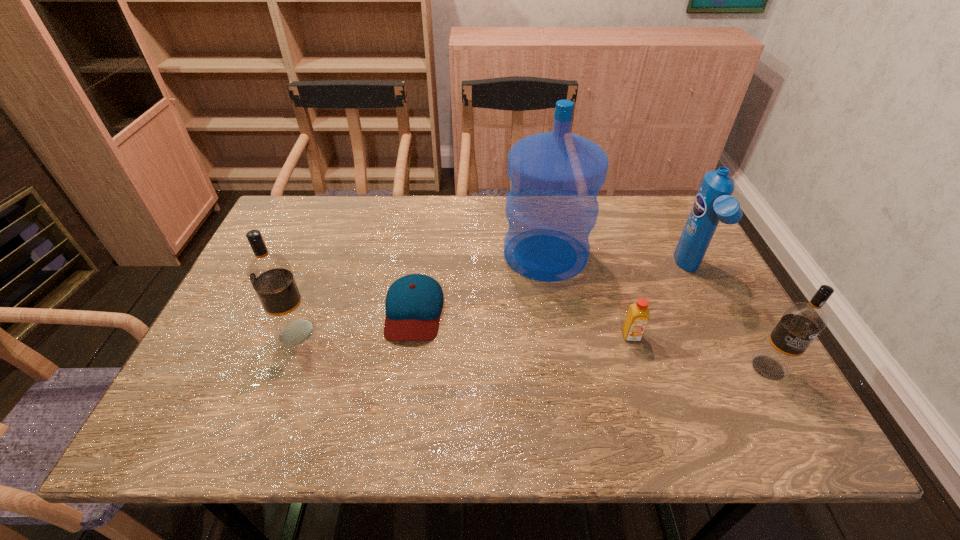
You are a GUI agent. You are given a task and a screenshot of the screen. Output one action in this format:
    pyautogui.click(x=<x>, y=<y>)
    Task: Click on the vacant point located between the shampoo and the second object from left to right
    
    Given the screenshot: What is the action you would take?
    pyautogui.click(x=552, y=291)

This screenshot has height=540, width=960. In order to click on free space between the third object from left to right and the shampoo in this screenshot , I will do `click(617, 262)`.

At what (x,y) coordinates should I click in order to perform the action: click on vacant space that is in between the nearer vodka and the orange juice. Please return your answer as a coordinate pair (x, y). This screenshot has width=960, height=540. Looking at the image, I should click on (700, 352).

Where is `free point between the third object from left to right and the shortest object`? The width and height of the screenshot is (960, 540). free point between the third object from left to right and the shortest object is located at coordinates (480, 282).

Image resolution: width=960 pixels, height=540 pixels. Find the location of `vacant space in between the shortest object and the shampoo`. vacant space in between the shortest object and the shampoo is located at coordinates (552, 291).

Where is `free space between the shorter vodka and the taller vodka`? The image size is (960, 540). free space between the shorter vodka and the taller vodka is located at coordinates (532, 350).

Locate an element on the screen. empty space between the left vodka and the third object from right to left is located at coordinates (464, 334).

Identify the location of vacant point located between the second object from left to right and the orange juice. The height and width of the screenshot is (540, 960). (522, 323).

The image size is (960, 540). Find the location of `vacant space that is in between the shortest object and the shampoo`. vacant space that is in between the shortest object and the shampoo is located at coordinates (552, 291).

I want to click on the closest object to the orange juice, so click(551, 208).